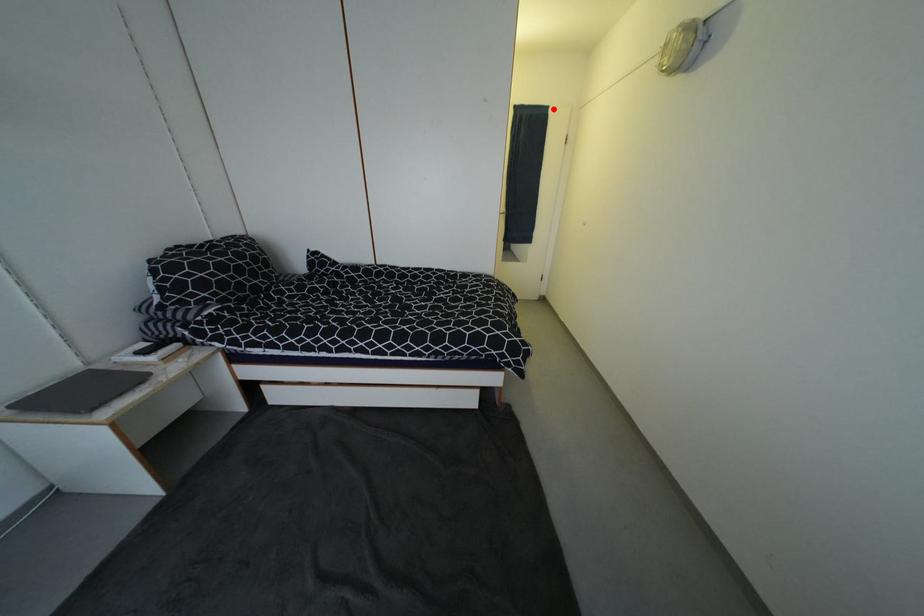
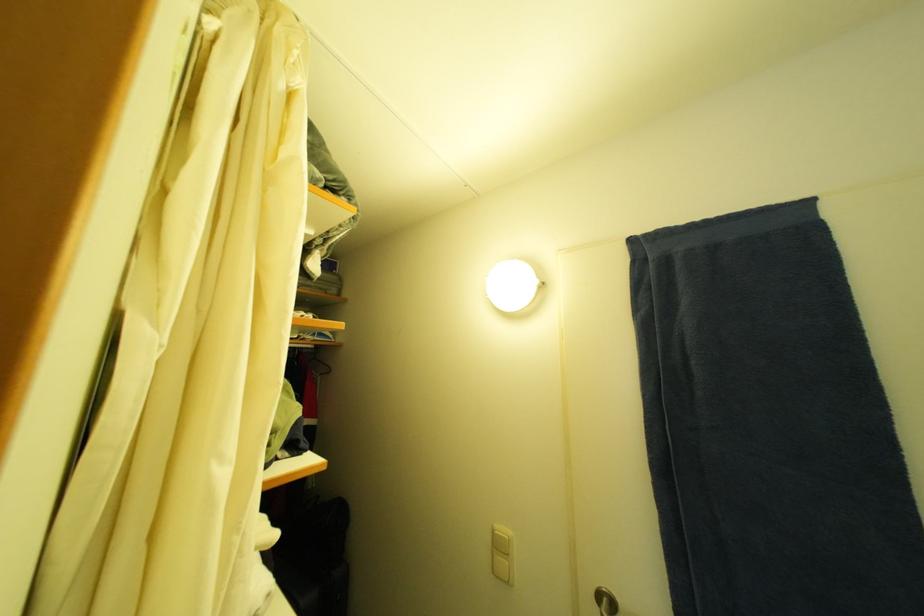
Where in the second image is the point corresponding to the highlighted location from the first image?

(813, 205)